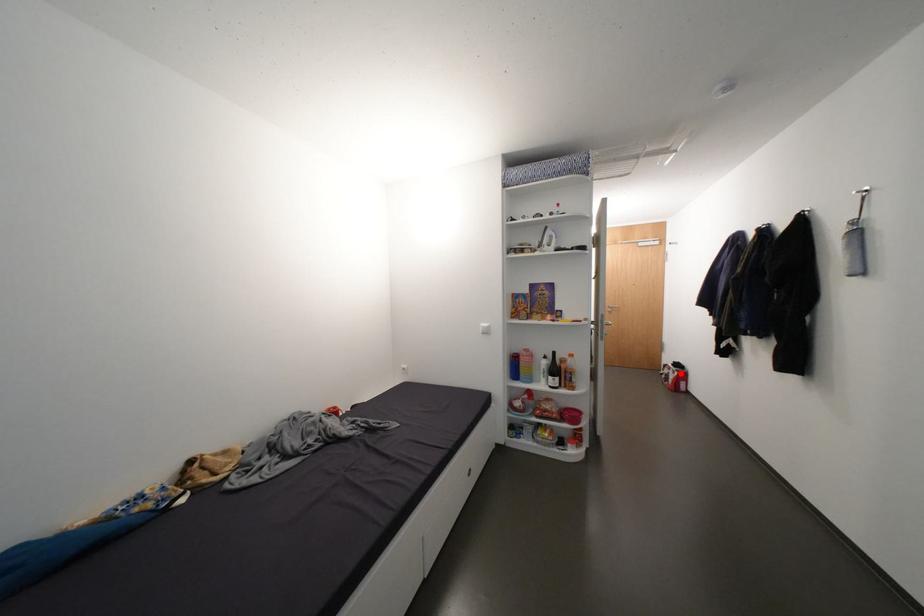
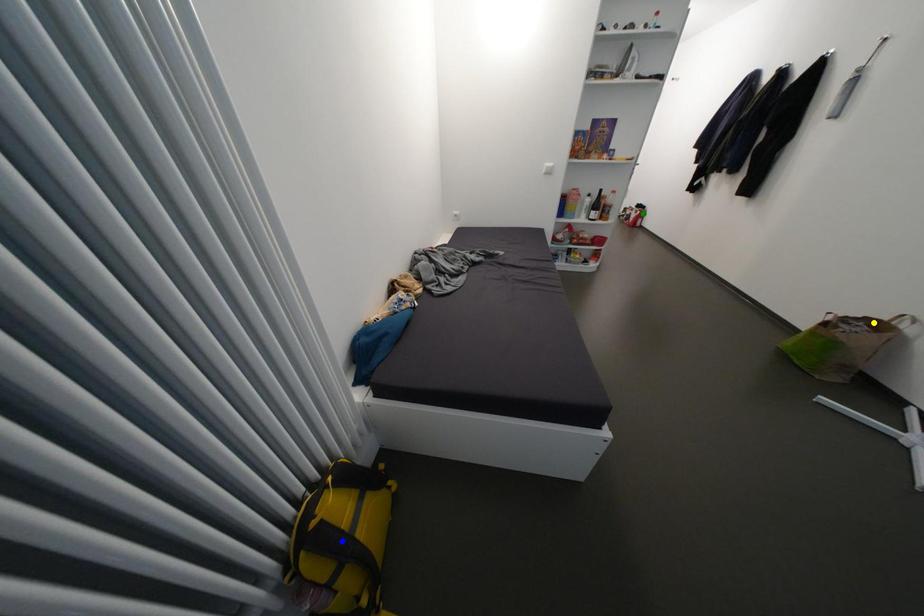
Question: I am providing you with two images of the same scene from different viewpoints. A red point is marked on the first image. You are given multiple points on the second image. Which point in image 2 is actually the same real-world point as the red point in image 1?

Choices:
 (A) blue point
 (B) green point
 (C) yellow point

Answer: (B)